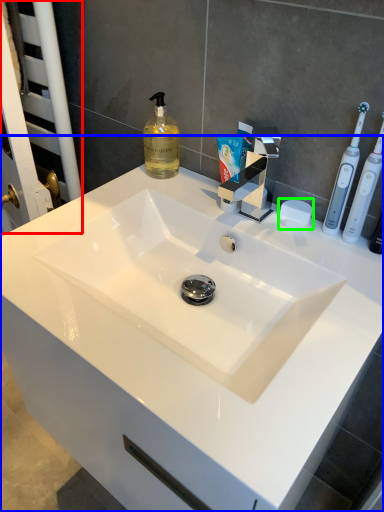
Question: Estimate the real-world distances between objects in this image. Which object is farther from screen door (highlighted by a red box), sink (highlighted by a blue box) or soap (highlighted by a green box)?

Choices:
 (A) sink
 (B) soap

Answer: (B)